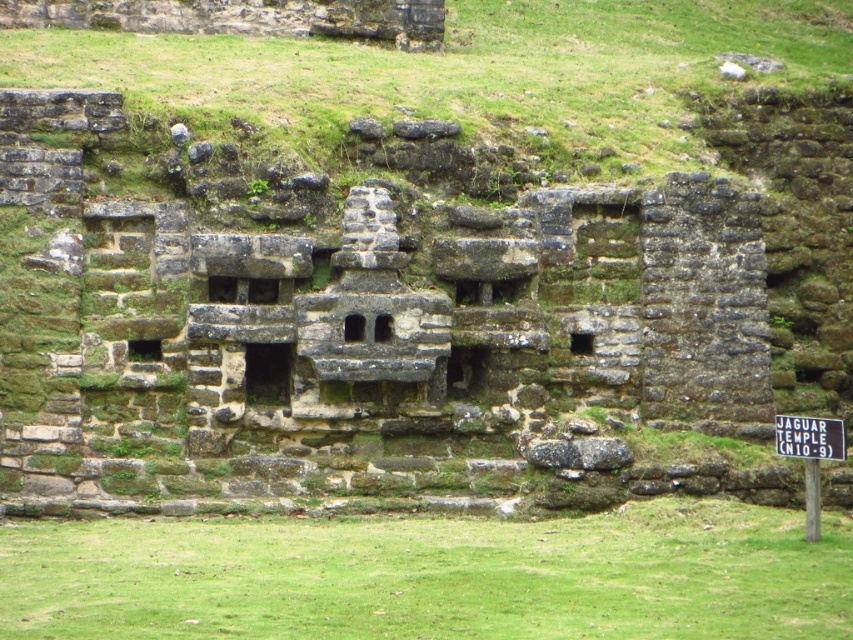
Question: Which point appears closest to the camera in this image?

Choices:
 (A) (804, 449)
 (B) (405, 588)

Answer: (B)

Question: Can you confirm if green grass at lower center is thinner than black paper sign at center?

Choices:
 (A) yes
 (B) no

Answer: (B)

Question: Based on their relative distances, which object is farther from the green mossy wall at upper center?

Choices:
 (A) black paper sign at center
 (B) green grass at lower center

Answer: (A)

Question: Considering the relative positions of green grass at lower center and black paper sign at center in the image provided, where is green grass at lower center located with respect to black paper sign at center?

Choices:
 (A) below
 (B) above

Answer: (A)

Question: Among these points, which one is nearest to the camera?

Choices:
 (A) (834, 426)
 (B) (780, 636)
 (C) (708, 32)

Answer: (B)

Question: Is green grass at lower center thinner than green mossy wall at upper center?

Choices:
 (A) yes
 (B) no

Answer: (A)